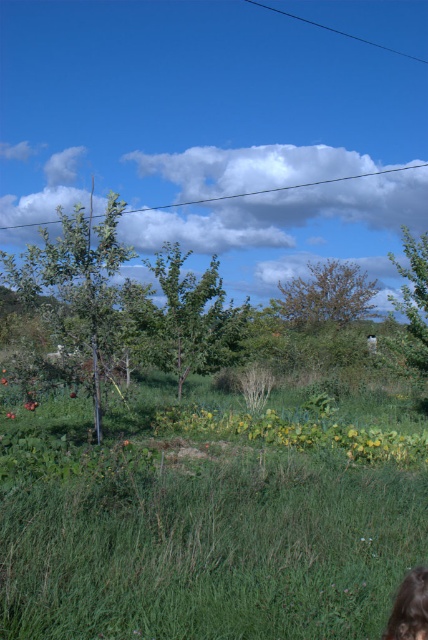
Can you confirm if green grassy field at lower center is positioned below green leafy tree at right?

Indeed, green grassy field at lower center is positioned under green leafy tree at right.

Consider the image. Which is more to the right, green grassy field at lower center or green leafy tree at right?

green leafy tree at right

Image resolution: width=428 pixels, height=640 pixels. What do you see at coordinates (208, 515) in the screenshot?
I see `green grassy field at lower center` at bounding box center [208, 515].

This screenshot has height=640, width=428. What are the coordinates of `green grassy field at lower center` in the screenshot? It's located at (208, 515).

Does brown textured tree at center come behind brown hair at lower right?

Yes, it is behind brown hair at lower right.

Between point (347, 307) and point (398, 634), which one is positioned behind?

The point (347, 307) is more distant.

Identify the location of brown textured tree at center. The height and width of the screenshot is (640, 428). (327, 294).

Between green grassy field at lower center and green leafy tree at center, which one has more height?

Standing taller between the two is green leafy tree at center.

Is point (148, 468) farther from camera compared to point (184, 257)?

No, (148, 468) is closer to viewer.

This screenshot has height=640, width=428. Describe the element at coordinates (208, 515) in the screenshot. I see `green grassy field at lower center` at that location.

Identify the location of green grassy field at lower center. (208, 515).